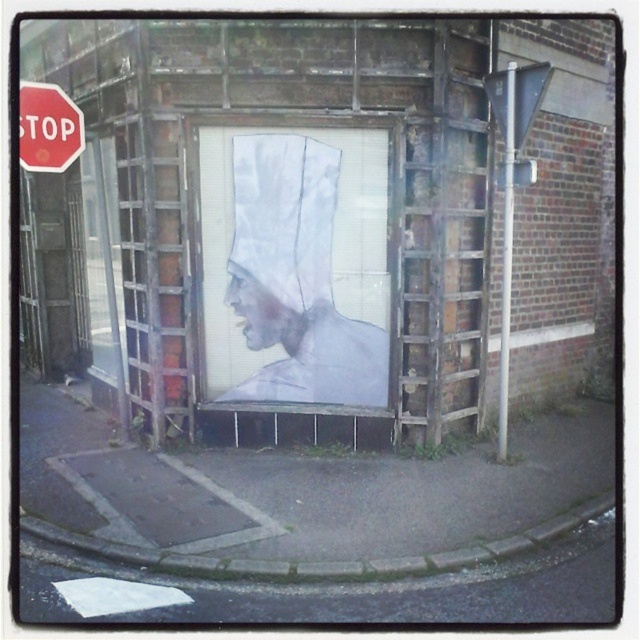
You are a delivery person holding a white paper bag at center. You need to place it on a table that is 20 feet away from you. Can you place it there without moving?

The white paper bag at center is 20.85 feet from camera, so you cannot place it on the table that is 20 feet away without moving because the distance is slightly longer than 20 feet.

You are standing on the street looking at the mural. There are two points marked on the wall. Which point is closer to you, point (253, 257) or point (38, 140)?

Point (38, 140) is closer to you because it is less further to the viewer than point (253, 257).